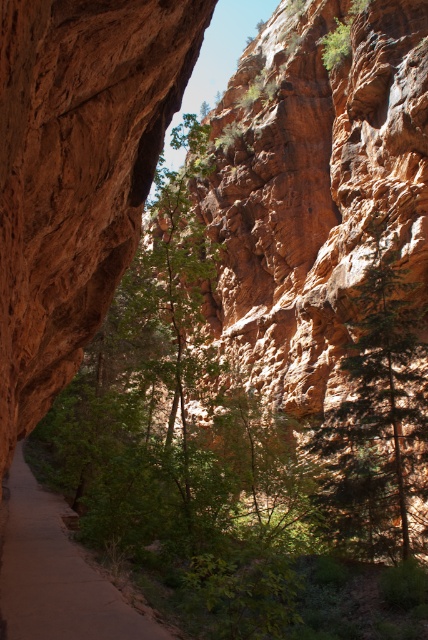
Question: Which point is closer to the camera?

Choices:
 (A) smooth dirt path at center
 (B) green textured tree at right

Answer: (A)

Question: Can you confirm if green textured tree at right is wider than smooth dirt path at center?

Choices:
 (A) no
 (B) yes

Answer: (A)

Question: Observing the image, what is the correct spatial positioning of green textured tree at right in reference to smooth dirt path at center?

Choices:
 (A) right
 (B) left

Answer: (A)

Question: Is green textured tree at right closer to the viewer compared to smooth dirt path at center?

Choices:
 (A) yes
 (B) no

Answer: (B)

Question: Among these objects, which one is nearest to the camera?

Choices:
 (A) green textured tree at right
 (B) smooth dirt path at center

Answer: (B)